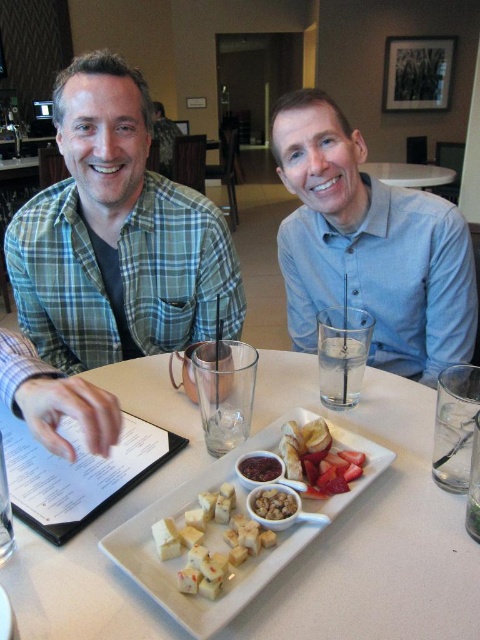
Question: Estimate the real-world distances between objects in this image. Which object is closer to the smooth white plate at center?

Choices:
 (A) green plaid shirt at upper left
 (B) white glossy table at center
 (C) smooth dark red jam at center

Answer: (C)

Question: Does light blue button-down shirt at center appear on the right side of white glossy table at center?

Choices:
 (A) yes
 (B) no

Answer: (B)

Question: Which point appears closest to the camera in this image?

Choices:
 (A) (107, 248)
 (B) (156, 579)
 (C) (391, 236)
 (D) (92, 129)

Answer: (B)

Question: Does green plaid shirt at upper left appear on the right side of smooth white plate at center?

Choices:
 (A) no
 (B) yes

Answer: (A)

Question: Is white ceramic plate at center to the left of smooth dark red jam at center from the viewer's perspective?

Choices:
 (A) no
 (B) yes

Answer: (B)

Question: Among these objects, which one is farthest from the camera?

Choices:
 (A) smooth white plate at center
 (B) crumbly brown nuts at center
 (C) white ceramic platter at center

Answer: (A)